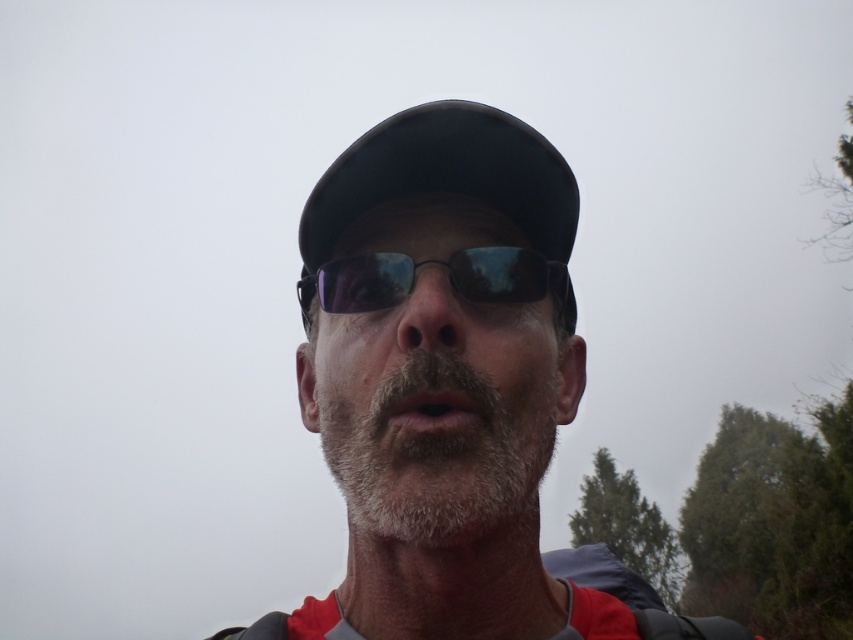
You are a photographer trying to capture a portrait of the person in the image. You notice the black matte baseball hat at center and the black reflective sunglasses at center. Which object is positioned higher on the person?

The black matte baseball hat at center is taller than the black reflective sunglasses at center, so it is positioned higher on the person.